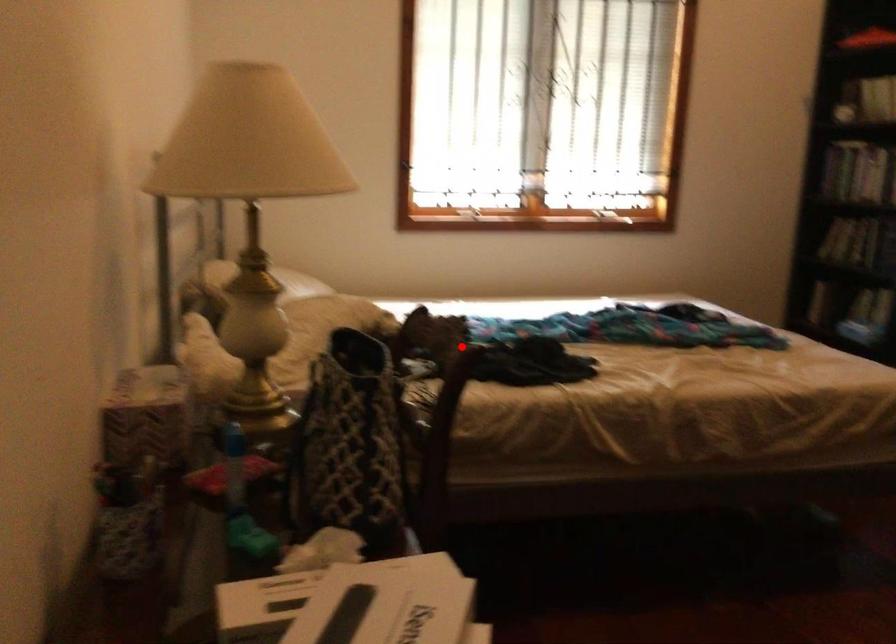
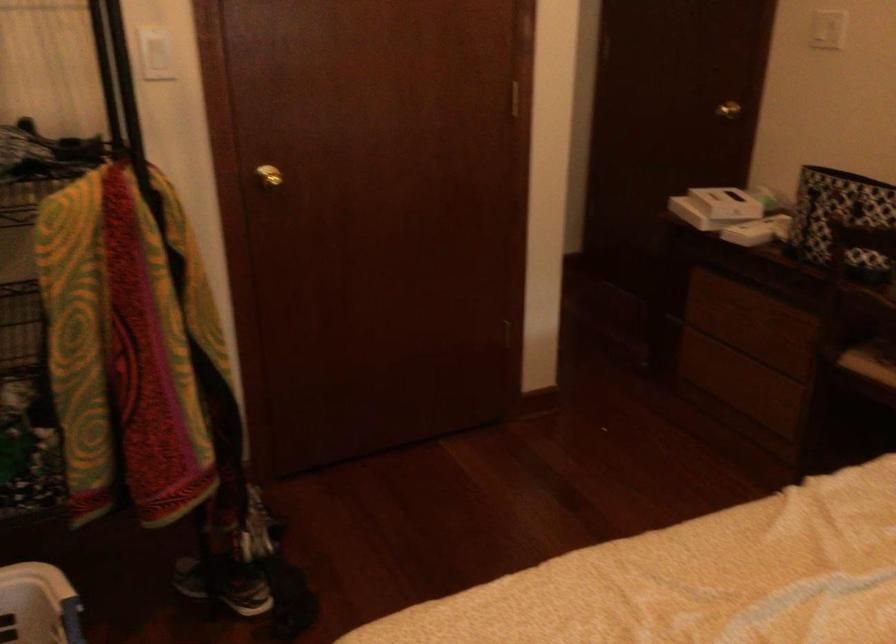
Locate, in the second image, the point that corresponds to the highlighted location in the first image.

(840, 218)